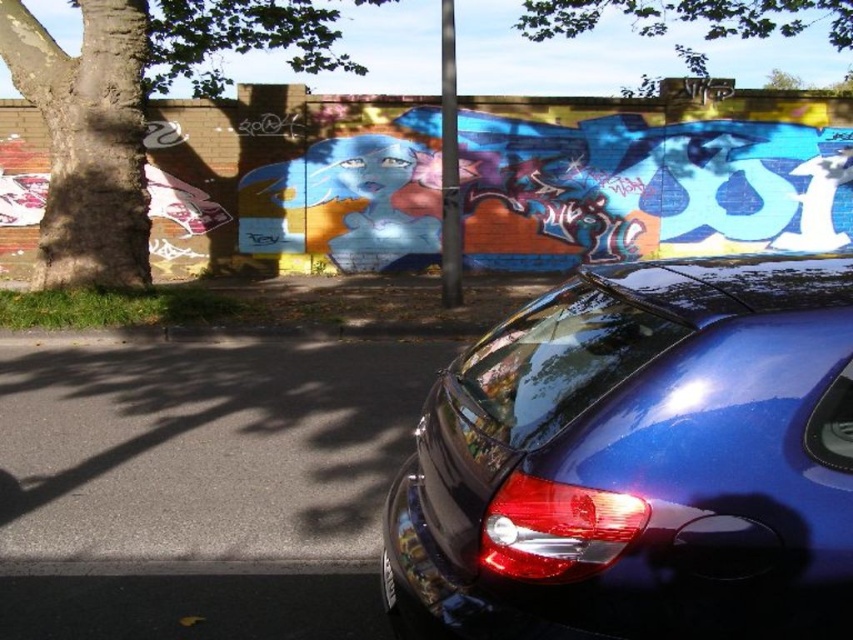
Question: Observing the image, what is the correct spatial positioning of brown rough tree trunk at left in reference to green leafy tree at upper center?

Choices:
 (A) right
 (B) left

Answer: (B)

Question: Among these objects, which one is farthest from the camera?

Choices:
 (A) brown rough tree trunk at left
 (B) black plastic license plate at lower center
 (C) green leafy tree at upper center
 (D) glossy blue car at lower right

Answer: (C)

Question: Estimate the real-world distances between objects in this image. Which object is farther from the green leafy tree at upper center?

Choices:
 (A) brown rough tree trunk at left
 (B) black plastic license plate at lower center

Answer: (B)

Question: Can you confirm if glossy blue car at lower right is positioned to the right of black plastic license plate at lower center?

Choices:
 (A) yes
 (B) no

Answer: (A)

Question: Does brown rough tree trunk at left have a lesser width compared to green leafy tree at upper center?

Choices:
 (A) no
 (B) yes

Answer: (B)

Question: Among these objects, which one is farthest from the camera?

Choices:
 (A) black plastic license plate at lower center
 (B) green leafy tree at upper center
 (C) glossy blue car at lower right

Answer: (B)